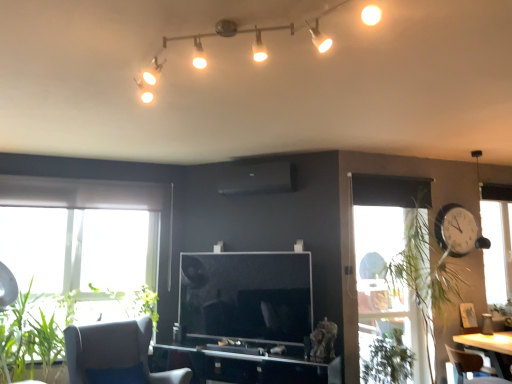
Question: Is transparent glass computer desk at center positioned far away from matte white track lights at upper center?

Choices:
 (A) yes
 (B) no

Answer: (A)

Question: Can you confirm if transparent glass computer desk at center is positioned to the left of matte white track lights at upper center?

Choices:
 (A) yes
 (B) no

Answer: (B)

Question: Can you confirm if transparent glass computer desk at center is taller than matte white track lights at upper center?

Choices:
 (A) yes
 (B) no

Answer: (A)

Question: Is transparent glass computer desk at center turned away from matte white track lights at upper center?

Choices:
 (A) yes
 (B) no

Answer: (B)

Question: Is transparent glass computer desk at center at the right side of matte white track lights at upper center?

Choices:
 (A) no
 (B) yes

Answer: (B)

Question: Considering the positions of gray fabric chair at lower left, which appears as the first chair when viewed from the left, and green leafy plant at lower left, the 4th plant positioned from the right, in the image, is gray fabric chair at lower left, which appears as the first chair when viewed from the left, bigger or smaller than green leafy plant at lower left, the 4th plant positioned from the right,?

Choices:
 (A) small
 (B) big

Answer: (B)

Question: Considering their positions, is gray fabric chair at lower left, the 2th chair in the right-to-left sequence, located in front of or behind green leafy plant at lower left, placed as the 1th plant when sorted from left to right?

Choices:
 (A) behind
 (B) front

Answer: (B)

Question: In terms of height, does gray fabric chair at lower left, the 2th chair in the right-to-left sequence, look taller or shorter compared to green leafy plant at lower left, the 4th plant positioned from the right?

Choices:
 (A) short
 (B) tall

Answer: (A)

Question: In terms of width, does gray fabric chair at lower left, which appears as the first chair when viewed from the left, look wider or thinner when compared to green leafy plant at lower left, placed as the 1th plant when sorted from left to right?

Choices:
 (A) thin
 (B) wide

Answer: (B)

Question: Is white plastic clock at right taller or shorter than green leafy plant at right, which ranks as the 4th plant in left-to-right order?

Choices:
 (A) short
 (B) tall

Answer: (A)

Question: Is point (460, 215) positioned closer to the camera than point (448, 289)?

Choices:
 (A) closer
 (B) farther

Answer: (B)

Question: Visually, is white plastic clock at right positioned to the left or to the right of green leafy plant at right, which ranks as the 4th plant in left-to-right order?

Choices:
 (A) left
 (B) right

Answer: (B)

Question: Looking at the image, does white plastic clock at right seem bigger or smaller compared to green leafy plant at right, which ranks as the 4th plant in left-to-right order?

Choices:
 (A) small
 (B) big

Answer: (A)

Question: Would you say white plastic clock at right is to the left or to the right of gray fabric chair at lower left, which appears as the first chair when viewed from the left, in the picture?

Choices:
 (A) right
 (B) left

Answer: (A)

Question: In terms of width, does white plastic clock at right look wider or thinner when compared to gray fabric chair at lower left, which appears as the first chair when viewed from the left?

Choices:
 (A) wide
 (B) thin

Answer: (B)